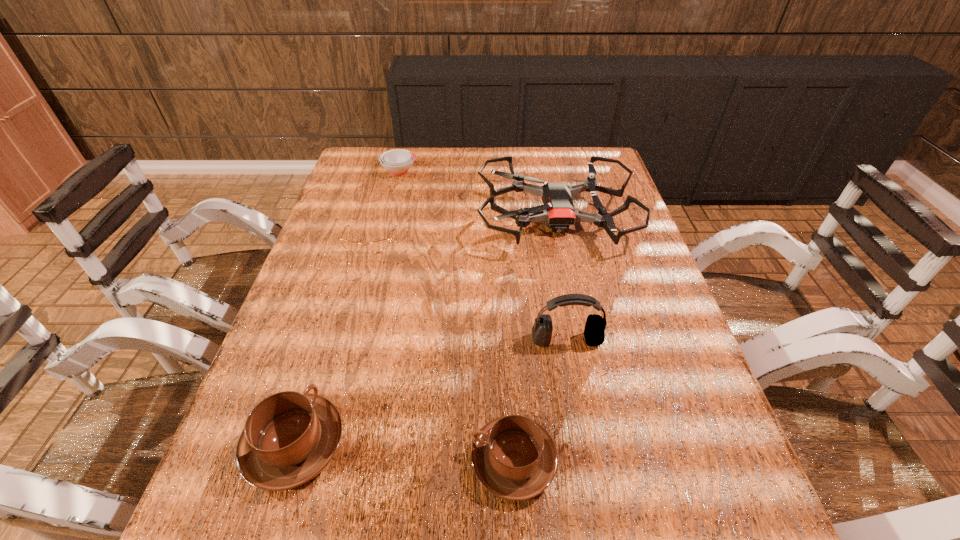
This screenshot has width=960, height=540. What are the coordinates of `free space located on the side of the taller cappuccino with the handle` in the screenshot? It's located at 324,351.

This screenshot has height=540, width=960. Identify the location of free region located on the side of the taller cappuccino with the handle. (343, 292).

Find the location of a particular element. Image resolution: width=960 pixels, height=540 pixels. free space located on the side of the right cappuccino with the handle is located at coordinates (291, 461).

Identify the location of free spot located on the side of the right cappuccino with the handle. (348, 461).

What are the coordinates of `vacant region located 0.110m on the side of the right cappuccino with the handle` in the screenshot? It's located at (409, 461).

Locate an element on the screen. The height and width of the screenshot is (540, 960). blank space located 0.300m on the front-facing side of the spectacles is located at coordinates (341, 343).

I want to click on vacant area situated 0.060m on the right of the fifth tallest object, so click(x=437, y=171).

At what (x,y) coordinates should I click in order to perform the action: click on vacant area located 0.200m with the camera facing forward on the drone. Please return your answer as a coordinate pair (x, y). Looking at the image, I should click on (410, 218).

Locate an element on the screen. The image size is (960, 540). vacant region located with the camera facing forward on the drone is located at coordinates (346, 218).

Where is `vacant area situated 0.340m with the camera facing forward on the drone`? The height and width of the screenshot is (540, 960). vacant area situated 0.340m with the camera facing forward on the drone is located at coordinates (362, 218).